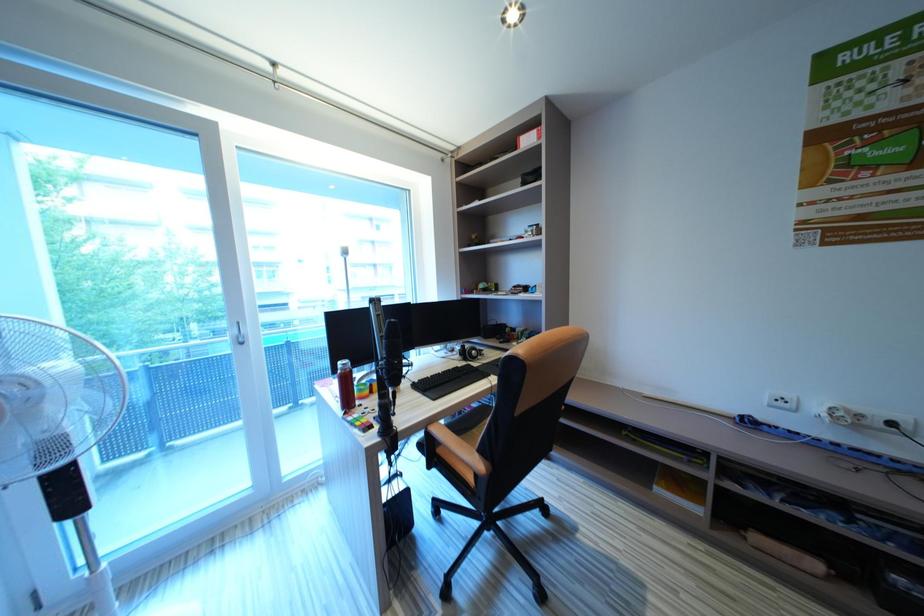
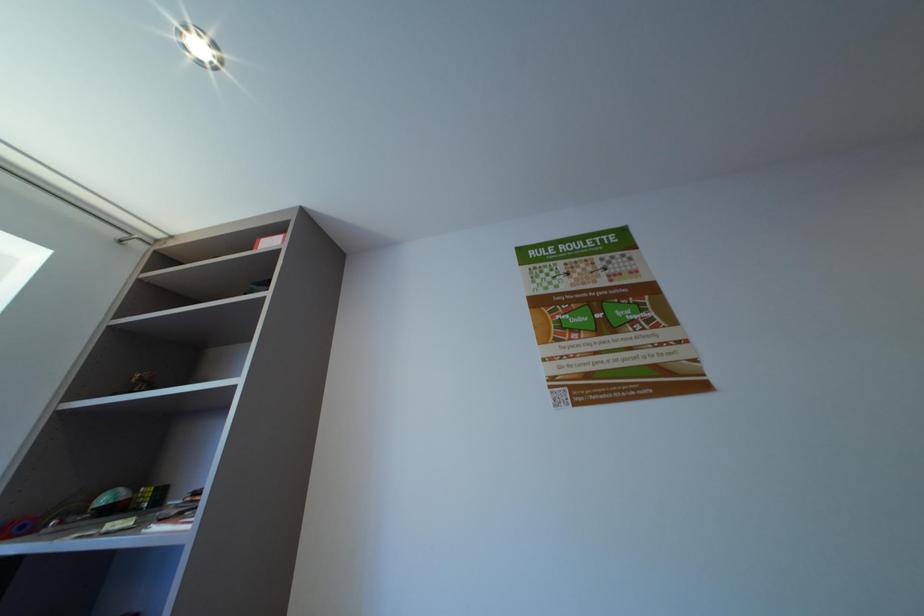
How did the camera likely rotate?

The camera rotated toward right-up.